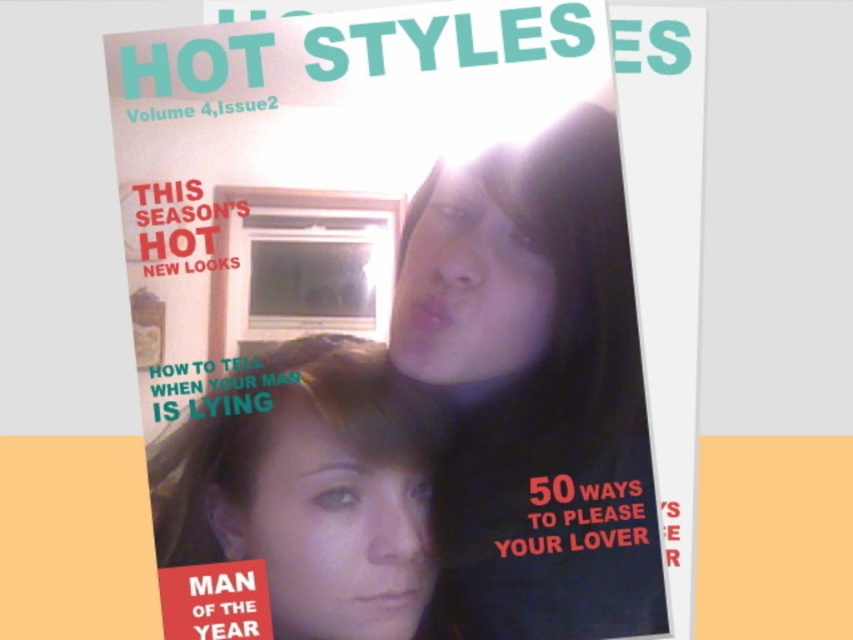
You are holding the matte plastic magazine at center and want to show the smooth skin face at center to a friend. Which direction should you move the magazine to reveal the face?

Since the matte plastic magazine at center is to the right of the smooth skin face at center, you should move the matte plastic magazine at center to the left to reveal the smooth skin face at center.

You are designing a layout for a magazine cover and need to ensure that the matte plastic magazine at center and the smooth skin face at upper right are positioned so that they don t overlap. Given their current distance of 1.35 inches, what is the minimum spacing you should maintain between them to prevent overlap?

The matte plastic magazine at center and smooth skin face at upper right are currently 1.35 inches apart. To prevent overlap, you should maintain at least 1.35 inches of spacing between them.